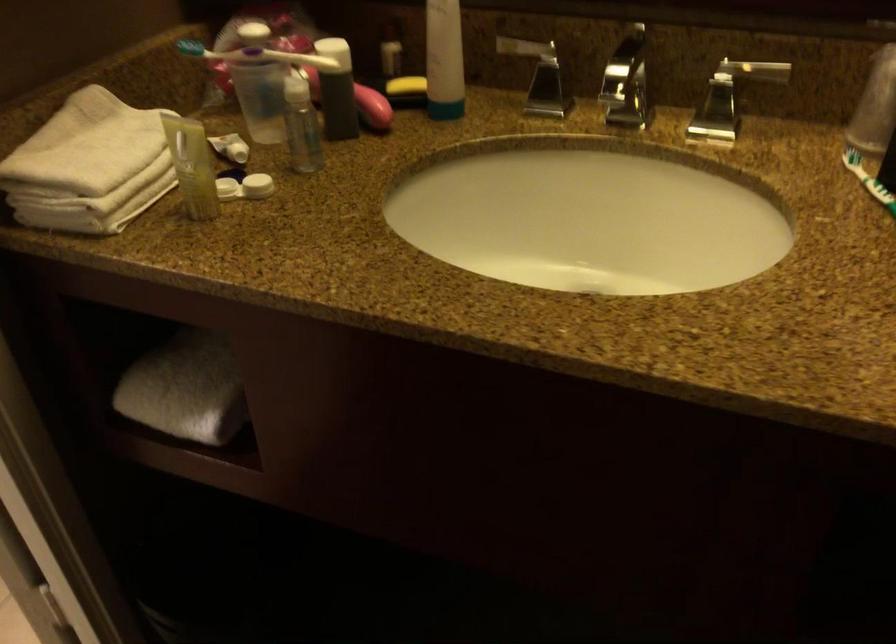
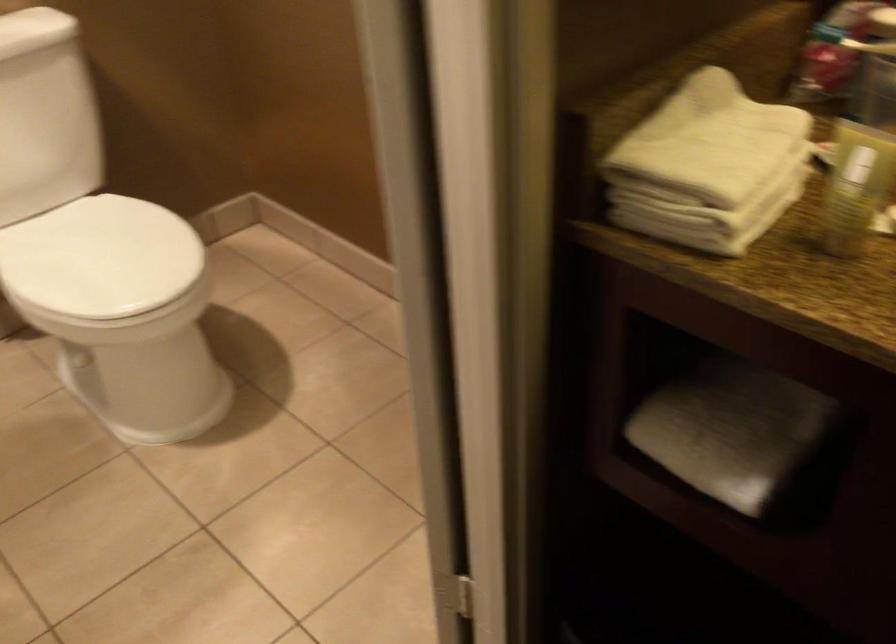
Question: Which direction would the cameraman need to move to produce the second image? Reply with the corresponding letter.

Choices:
 (A) Left
 (B) Right
 (C) Forward
 (D) Backward

Answer: (A)